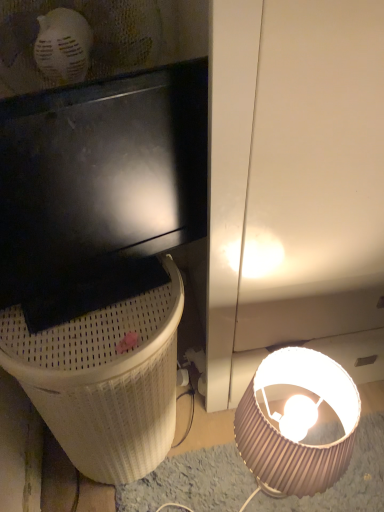
Question: Can you confirm if white textured trash bin/can at lower left is smaller than pink pleated lampshade at lower right?

Choices:
 (A) no
 (B) yes

Answer: (A)

Question: From a real-world perspective, is white textured trash bin/can at lower left positioned over pink pleated lampshade at lower right based on gravity?

Choices:
 (A) yes
 (B) no

Answer: (A)

Question: Would you say white textured trash bin/can at lower left is outside pink pleated lampshade at lower right?

Choices:
 (A) yes
 (B) no

Answer: (A)

Question: From the image's perspective, does white textured trash bin/can at lower left appear higher than pink pleated lampshade at lower right?

Choices:
 (A) yes
 (B) no

Answer: (A)

Question: Can you confirm if white textured trash bin/can at lower left is positioned to the right of pink pleated lampshade at lower right?

Choices:
 (A) yes
 (B) no

Answer: (B)

Question: Does white textured trash bin/can at lower left have a lesser height compared to pink pleated lampshade at lower right?

Choices:
 (A) yes
 (B) no

Answer: (B)

Question: Are pink pleated lampshade at lower right and white textured trash bin/can at lower left beside each other?

Choices:
 (A) no
 (B) yes

Answer: (A)

Question: Does pink pleated lampshade at lower right lie in front of white textured trash bin/can at lower left?

Choices:
 (A) yes
 (B) no

Answer: (B)

Question: Would you say pink pleated lampshade at lower right is outside white textured trash bin/can at lower left?

Choices:
 (A) no
 (B) yes

Answer: (B)

Question: Is pink pleated lampshade at lower right thinner than white textured trash bin/can at lower left?

Choices:
 (A) yes
 (B) no

Answer: (A)

Question: Is pink pleated lampshade at lower right at the right side of white textured trash bin/can at lower left?

Choices:
 (A) yes
 (B) no

Answer: (A)

Question: Is pink pleated lampshade at lower right oriented away from white textured trash bin/can at lower left?

Choices:
 (A) yes
 (B) no

Answer: (B)

Question: Visually, is white textured trash bin/can at lower left positioned to the left or to the right of pink pleated lampshade at lower right?

Choices:
 (A) left
 (B) right

Answer: (A)